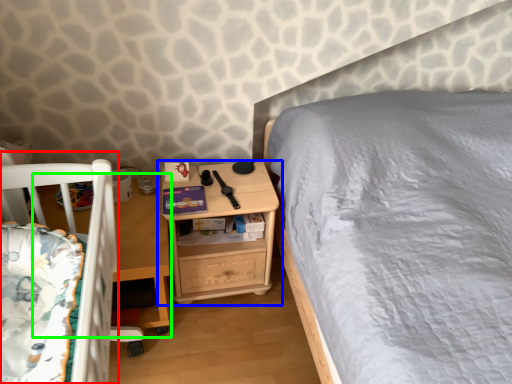
Question: Estimate the real-world distances between objects in this image. Which object is farther from infant bed (highlighted by a red box), nightstand (highlighted by a blue box) or table (highlighted by a green box)?

Choices:
 (A) nightstand
 (B) table

Answer: (A)